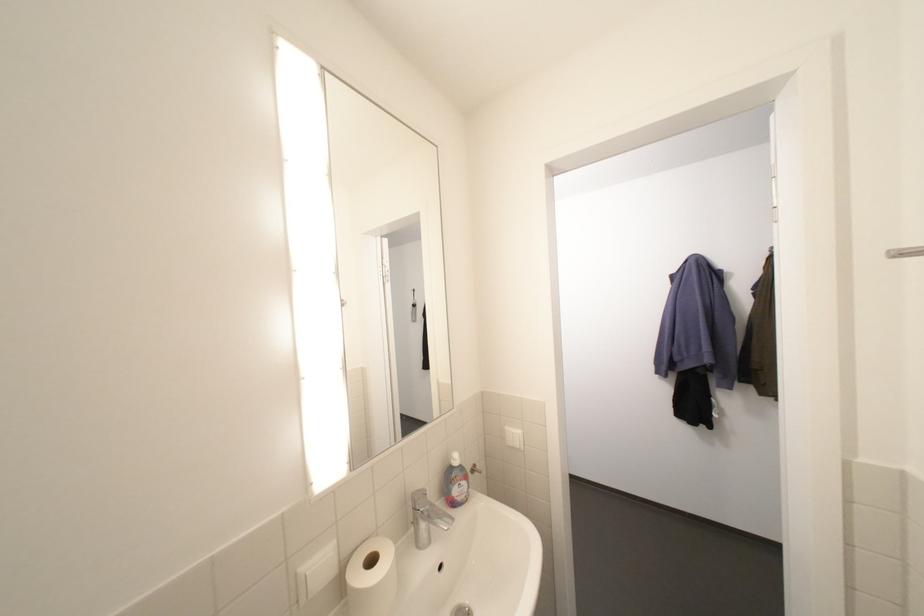
At what (x,y) coordinates should I click in order to perform the action: click on metallic faucet handle. Please return your answer as a coordinate pair (x, y). Image resolution: width=924 pixels, height=616 pixels. Looking at the image, I should click on (439, 516).